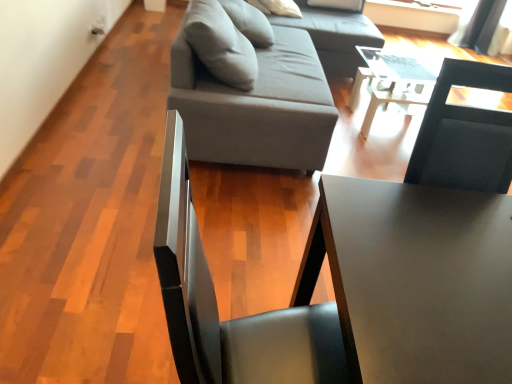
Question: Does gray fabric studio couch at upper center have a lesser height compared to matte black table at center, which ranks as the second table in top-to-bottom order?

Choices:
 (A) yes
 (B) no

Answer: (B)

Question: Can you confirm if gray fabric studio couch at upper center is thinner than matte black table at center, acting as the second table starting from the back?

Choices:
 (A) no
 (B) yes

Answer: (A)

Question: From the image's perspective, is gray fabric studio couch at upper center above matte black table at center, which ranks as the second table in top-to-bottom order?

Choices:
 (A) no
 (B) yes

Answer: (B)

Question: Can you confirm if gray fabric studio couch at upper center is taller than matte black table at center, which ranks as the second table in top-to-bottom order?

Choices:
 (A) no
 (B) yes

Answer: (B)

Question: Could you tell me if gray fabric studio couch at upper center is facing matte black table at center, marked as the first table in a front-to-back arrangement?

Choices:
 (A) yes
 (B) no

Answer: (B)

Question: In terms of width, does white glossy table at center, which is the first table in top-to-bottom order, look wider or thinner when compared to matte black table at center, which is the 1th table from bottom to top?

Choices:
 (A) wide
 (B) thin

Answer: (B)

Question: In terms of height, does white glossy table at center, which is the 2th table from front to back, look taller or shorter compared to matte black table at center, which ranks as the second table in top-to-bottom order?

Choices:
 (A) tall
 (B) short

Answer: (B)

Question: Considering the relative positions of white glossy table at center, arranged as the first table when viewed from the back, and matte black table at center, marked as the first table in a front-to-back arrangement, in the image provided, is white glossy table at center, arranged as the first table when viewed from the back, to the left or to the right of matte black table at center, marked as the first table in a front-to-back arrangement,?

Choices:
 (A) left
 (B) right

Answer: (B)

Question: Does point (378, 91) appear closer or farther from the camera than point (395, 332)?

Choices:
 (A) farther
 (B) closer

Answer: (A)

Question: Considering the positions of point (352, 14) and point (199, 107), is point (352, 14) closer or farther from the camera than point (199, 107)?

Choices:
 (A) closer
 (B) farther

Answer: (B)

Question: Considering the positions of gray fabric couch at upper center and gray fabric studio couch at upper center in the image, is gray fabric couch at upper center wider or thinner than gray fabric studio couch at upper center?

Choices:
 (A) thin
 (B) wide

Answer: (B)

Question: From the image's perspective, is gray fabric couch at upper center positioned above or below gray fabric studio couch at upper center?

Choices:
 (A) above
 (B) below

Answer: (A)

Question: In the image, is gray fabric couch at upper center positioned in front of or behind gray fabric studio couch at upper center?

Choices:
 (A) behind
 (B) front

Answer: (A)

Question: In terms of height, does gray fabric studio couch at upper center look taller or shorter compared to white glossy table at center, acting as the second table starting from the bottom?

Choices:
 (A) short
 (B) tall

Answer: (B)

Question: In terms of width, does gray fabric studio couch at upper center look wider or thinner when compared to white glossy table at center, arranged as the first table when viewed from the back?

Choices:
 (A) wide
 (B) thin

Answer: (A)